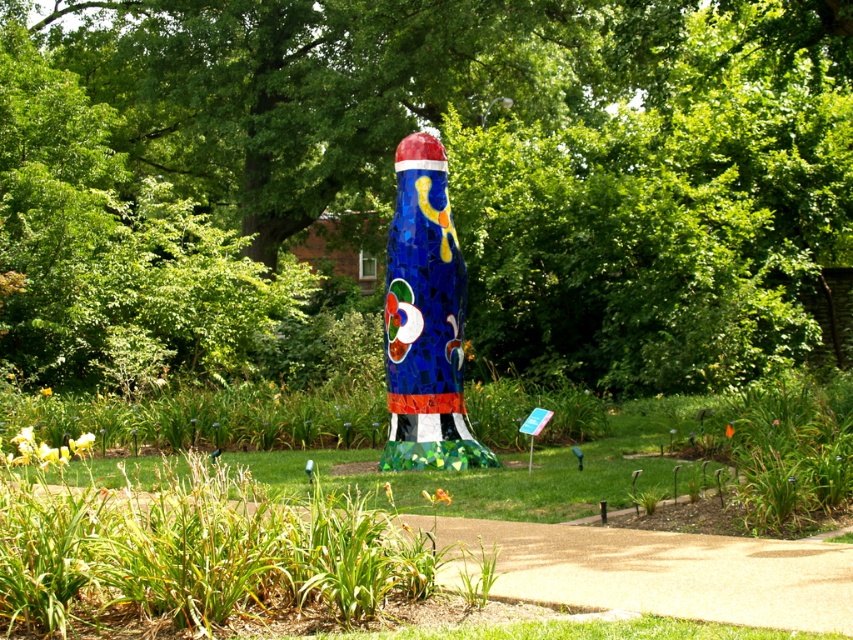
Question: Among these points, which one is farthest from the camera?

Choices:
 (A) (427, 406)
 (B) (39, 323)

Answer: (B)

Question: Considering the relative positions of mosaic sculpture at center and shiny mosaic totem pole at center in the image provided, where is mosaic sculpture at center located with respect to shiny mosaic totem pole at center?

Choices:
 (A) right
 (B) left

Answer: (B)

Question: Does mosaic sculpture at center have a lesser width compared to shiny mosaic totem pole at center?

Choices:
 (A) no
 (B) yes

Answer: (A)

Question: Can you confirm if mosaic sculpture at center is positioned above shiny mosaic totem pole at center?

Choices:
 (A) yes
 (B) no

Answer: (A)

Question: Which point is closer to the camera?

Choices:
 (A) (422, 196)
 (B) (625, 19)

Answer: (A)